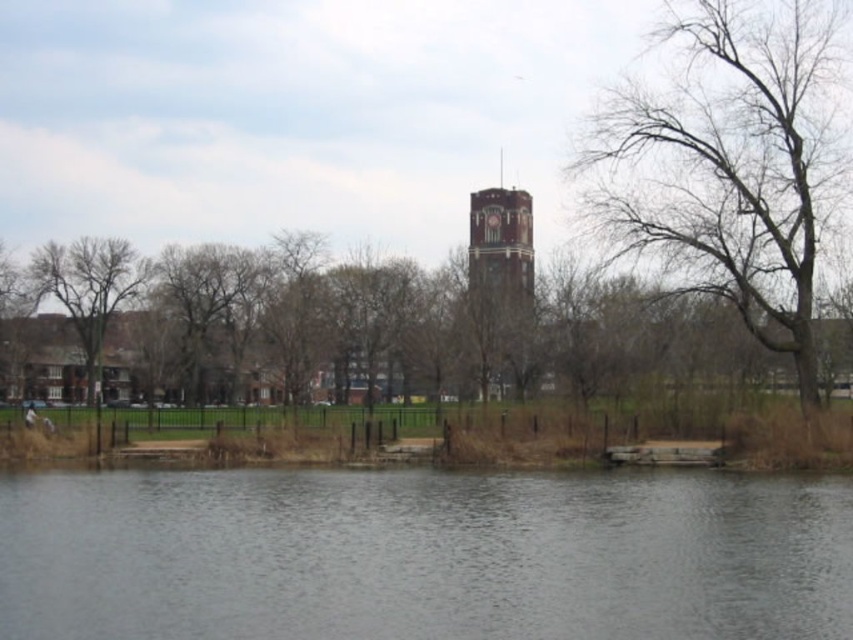
Is point (0, 532) in front of point (616, 161)?

Yes, point (0, 532) is closer to viewer.

Who is positioned more to the right, gray water at lower center or bare branches at right?

From the viewer's perspective, bare branches at right appears more on the right side.

The image size is (853, 640). I want to click on gray water at lower center, so click(422, 556).

You are a GUI agent. You are given a task and a screenshot of the screen. Output one action in this format:
    pyautogui.click(x=<x>, y=<y>)
    Task: Click on the gray water at lower center
    This screenshot has height=640, width=853.
    Given the screenshot: What is the action you would take?
    pyautogui.click(x=422, y=556)